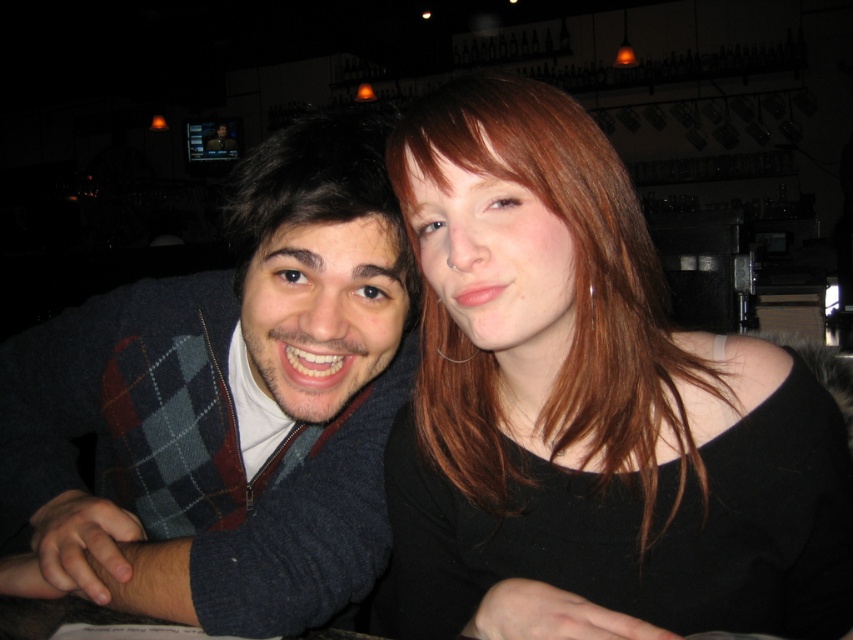
You are a photographer standing at the camera position. You want to take a closeup shot of the dark blue sweater at left without moving the camera. Is it possible to do so?

The dark blue sweater at left is 23.99 inches away from camera, so yes, it is possible to take a closeup shot of the dark blue sweater at left without moving the camera.

You are a photographer positioned behind the two people in the image. You want to take a photo focusing on the matte black shirt at center without the dark brown smooth hair at left blocking the view. Is this possible based on their positions?

The matte black shirt at center is closer to the viewer than the dark brown smooth hair at left, so taking a photo focusing on the matte black shirt at center without the dark brown smooth hair at left blocking the view is possible since the shirt is in front.